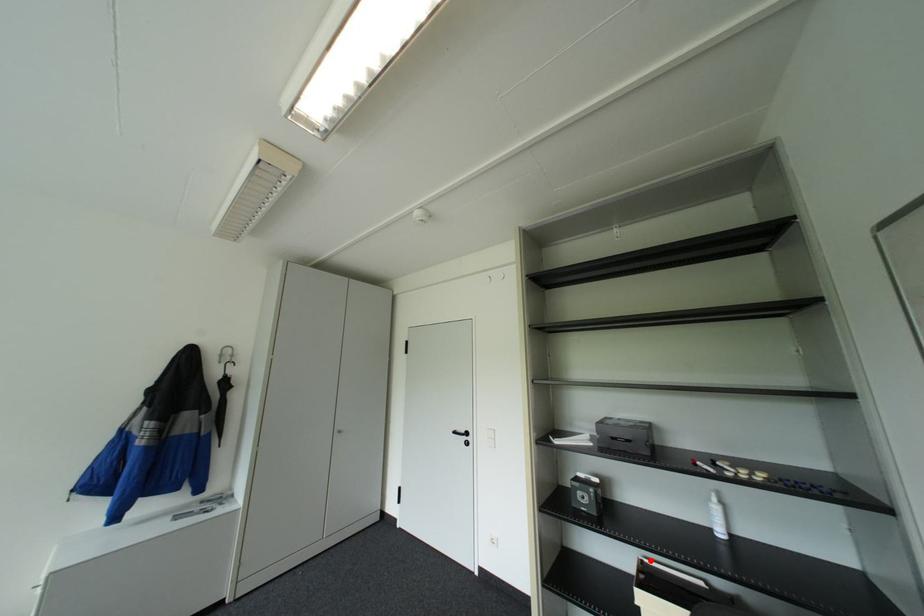
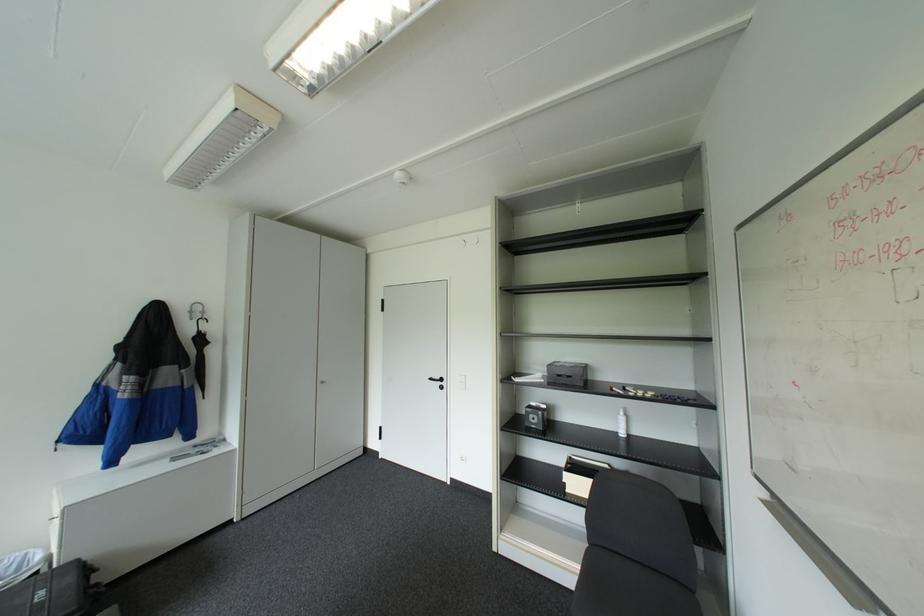
Question: I am providing you with two images of the same scene from different viewpoints. In image1, a red point is highlighted. Considering the same 3D point in image2, which of the following is correct?

Choices:
 (A) It is closer
 (B) It is farther

Answer: (B)